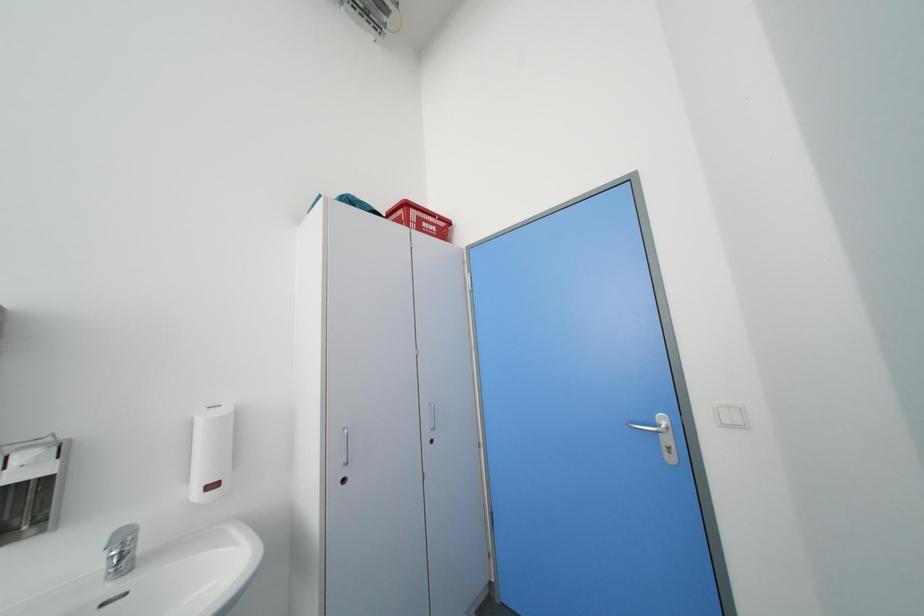
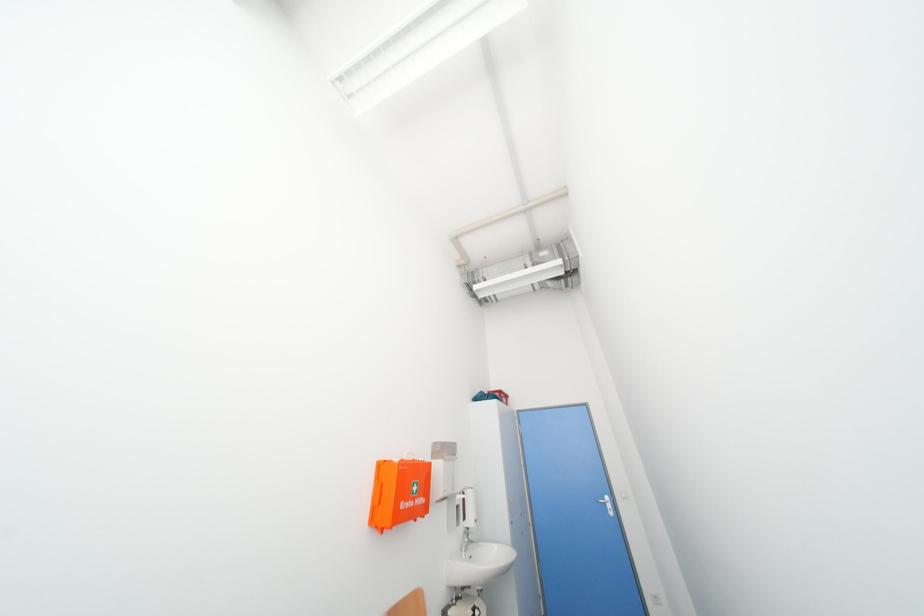
The images are taken continuously from a first-person perspective. In which direction are you moving?

The cameraman walked toward left, backward.